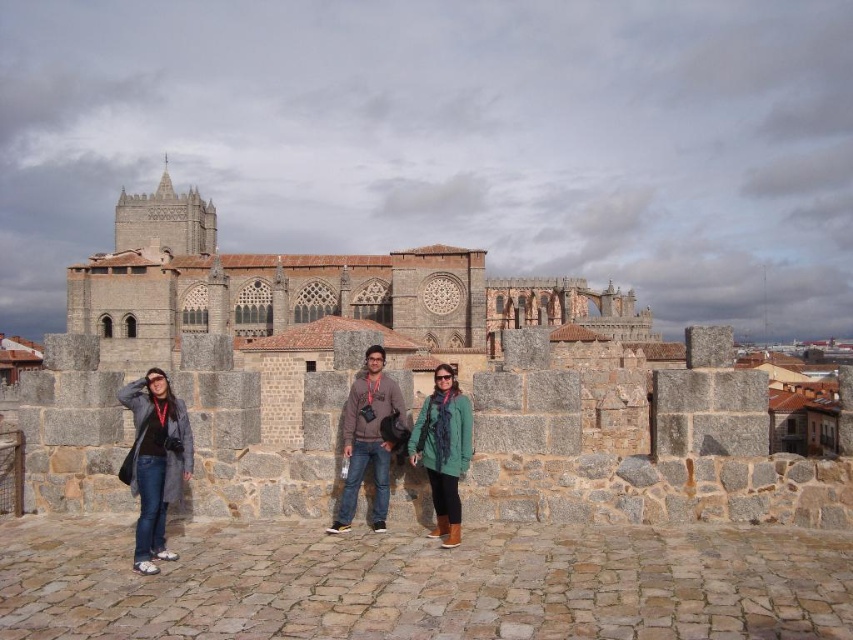
You are standing on the cobblestone platform in front of the historic stone wall and want to take a photo of the point at coordinates point (67, 292). Your camera has a maximum focus range of 130 meters. Will you be able to focus on that point?

The point at point (67, 292) is 134.64 meters away from you, which exceeds your camera maximum focus range of 130 meters. Therefore, you won not be able to focus on that point.

You are a tour guide explaining the historical site to visitors. You point out the gray stone fort at center and the gray wool coat at left. Which object is wider? Please explain your reasoning based on the scene.

The gray stone fort at center is wider than the gray wool coat at left according to the description.